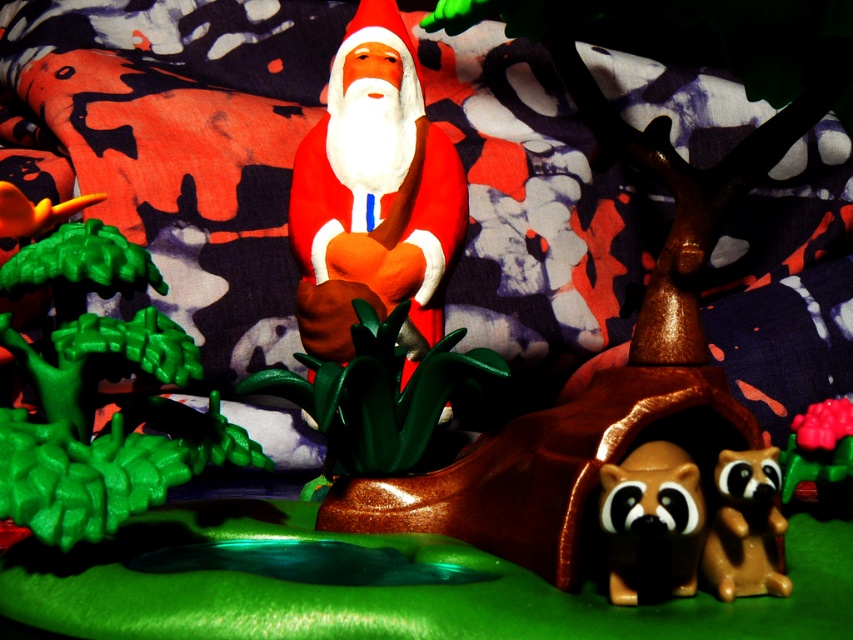
Question: Which of the following is the farthest from the observer?

Choices:
 (A) (833, 449)
 (B) (726, 560)
 (C) (421, 124)

Answer: (C)

Question: Based on their relative distances, which object is nearer to the brown glossy raccoon at lower right?

Choices:
 (A) brown matte raccoon at lower right
 (B) rubberized green toy at lower right

Answer: (A)

Question: Which of these objects is positioned closest to the brown matte raccoon at lower right?

Choices:
 (A) matte plastic santa at center
 (B) rubberized green toy at lower right

Answer: (B)

Question: Does matte plastic santa at center have a smaller size compared to rubberized green toy at lower right?

Choices:
 (A) yes
 (B) no

Answer: (B)

Question: Is matte plastic santa at center further to camera compared to brown matte raccoon at lower right?

Choices:
 (A) no
 (B) yes

Answer: (B)

Question: Is matte plastic santa at center to the left of rubberized green toy at lower right from the viewer's perspective?

Choices:
 (A) no
 (B) yes

Answer: (B)